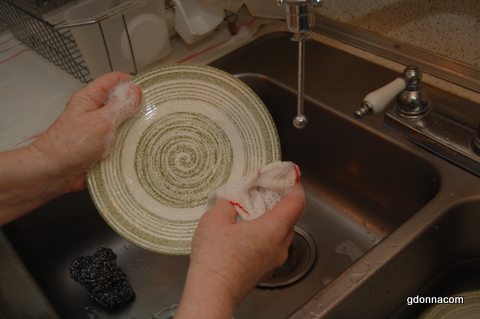
The height and width of the screenshot is (319, 480). What are the coordinates of `left faucet handle` in the screenshot? It's located at (378, 99).